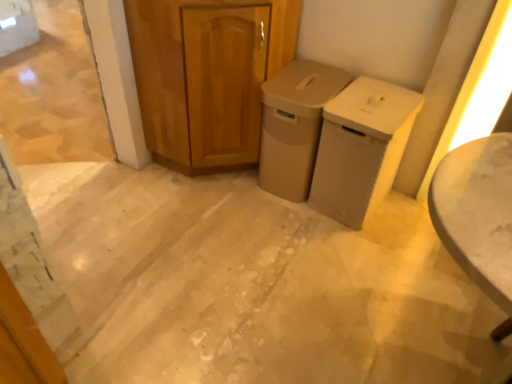
Question: From the image's perspective, is beige matte trash can at center, positioned as the first waste container in left-to-right order, above wooden cabinet at center?

Choices:
 (A) no
 (B) yes

Answer: (A)

Question: Does beige matte trash can at center, positioned as the 2th waste container in right-to-left order, have a smaller size compared to wooden cabinet at center?

Choices:
 (A) yes
 (B) no

Answer: (A)

Question: Is beige matte trash can at center, positioned as the first waste container in left-to-right order, positioned with its back to wooden cabinet at center?

Choices:
 (A) yes
 (B) no

Answer: (B)

Question: Is beige matte trash can at center, positioned as the first waste container in left-to-right order, closer to camera compared to wooden cabinet at center?

Choices:
 (A) yes
 (B) no

Answer: (B)

Question: Considering the relative positions of beige matte trash can at center, positioned as the first waste container in left-to-right order, and wooden cabinet at center in the image provided, is beige matte trash can at center, positioned as the first waste container in left-to-right order, to the left of wooden cabinet at center from the viewer's perspective?

Choices:
 (A) yes
 (B) no

Answer: (B)

Question: Do you think beige textured waste bin at center-right, acting as the second waste container starting from the left, is within beige matte trash can at center, positioned as the first waste container in left-to-right order, or outside of it?

Choices:
 (A) outside
 (B) inside

Answer: (A)

Question: From a real-world perspective, is beige textured waste bin at center-right, positioned as the first waste container in right-to-left order, physically located above or below beige matte trash can at center, positioned as the 2th waste container in right-to-left order?

Choices:
 (A) below
 (B) above

Answer: (A)

Question: From the image's perspective, is beige textured waste bin at center-right, positioned as the first waste container in right-to-left order, positioned above or below beige matte trash can at center, positioned as the first waste container in left-to-right order?

Choices:
 (A) above
 (B) below

Answer: (B)

Question: Considering their positions, is beige textured waste bin at center-right, acting as the second waste container starting from the left, located in front of or behind beige matte trash can at center, positioned as the first waste container in left-to-right order?

Choices:
 (A) behind
 (B) front

Answer: (B)

Question: From the image's perspective, relative to beige matte trash can at center, positioned as the first waste container in left-to-right order, is wooden cabinet at center above or below?

Choices:
 (A) above
 (B) below

Answer: (A)

Question: In terms of height, does wooden cabinet at center look taller or shorter compared to beige matte trash can at center, positioned as the first waste container in left-to-right order?

Choices:
 (A) tall
 (B) short

Answer: (A)

Question: Looking at their shapes, would you say wooden cabinet at center is wider or thinner than beige matte trash can at center, positioned as the first waste container in left-to-right order?

Choices:
 (A) wide
 (B) thin

Answer: (A)

Question: Is point 165,62 closer or farther from the camera than point 268,119?

Choices:
 (A) farther
 (B) closer

Answer: (B)

Question: From a real-world perspective, is beige matte trash can at center, positioned as the first waste container in left-to-right order, above or below beige textured waste bin at center-right, positioned as the first waste container in right-to-left order?

Choices:
 (A) above
 (B) below

Answer: (A)

Question: Would you say beige matte trash can at center, positioned as the first waste container in left-to-right order, is to the left or to the right of beige textured waste bin at center-right, positioned as the first waste container in right-to-left order, in the picture?

Choices:
 (A) right
 (B) left

Answer: (B)